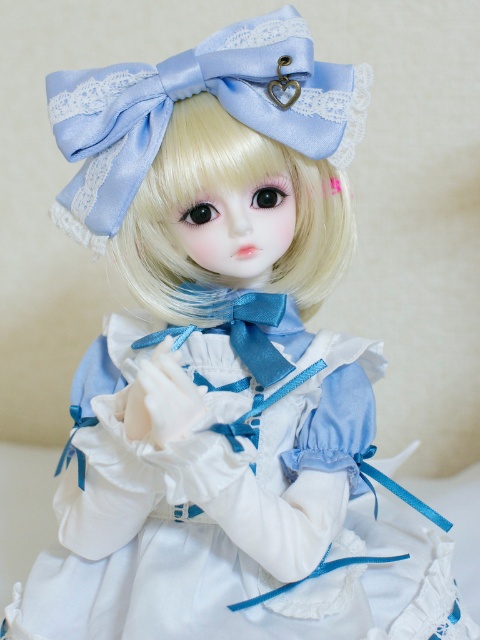
Is point (230, 49) positioned in front of point (165, 332)?

Yes.

Is point (237, 77) positioned in front of point (251, 356)?

That is True.

Where is `satin/light blue bonnet at upper center`? This screenshot has height=640, width=480. satin/light blue bonnet at upper center is located at coordinates (190, 97).